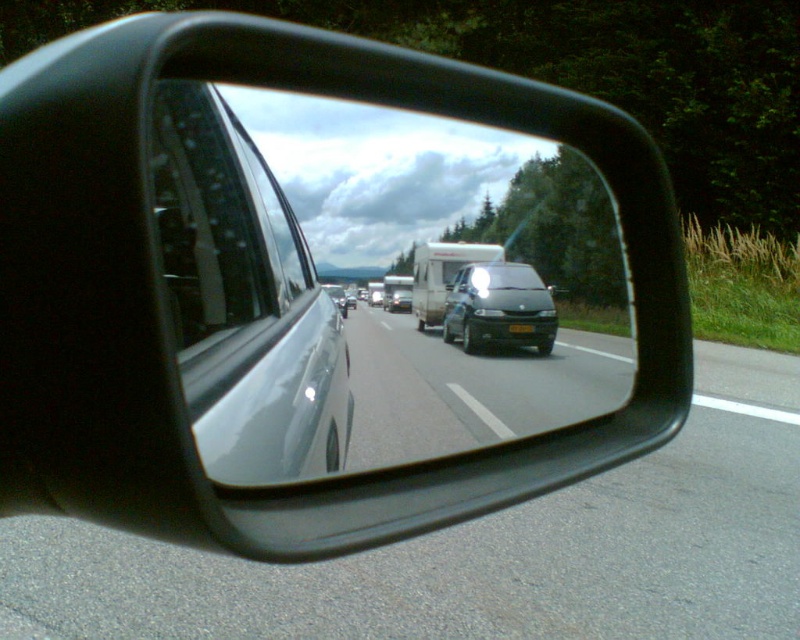
You are driving and notice two vehicles in your side mirror. The white glossy trailer truck at center and the satin silver sedan at center. Which one is shorter in height?

The white glossy trailer truck at center is not as tall as the satin silver sedan at center, so the white glossy trailer truck at center is shorter.

You are driving and need to change lanes. You look at your side mirror and see the black glossy minivan at center and the satin silver van at center. Based on their distance apart, can you safely make a lane change without stopping?

The black glossy minivan at center and the satin silver van at center are 2.48 meters apart. Since this distance is insufficient for a safe lane change, you should wait for a safer opportunity.